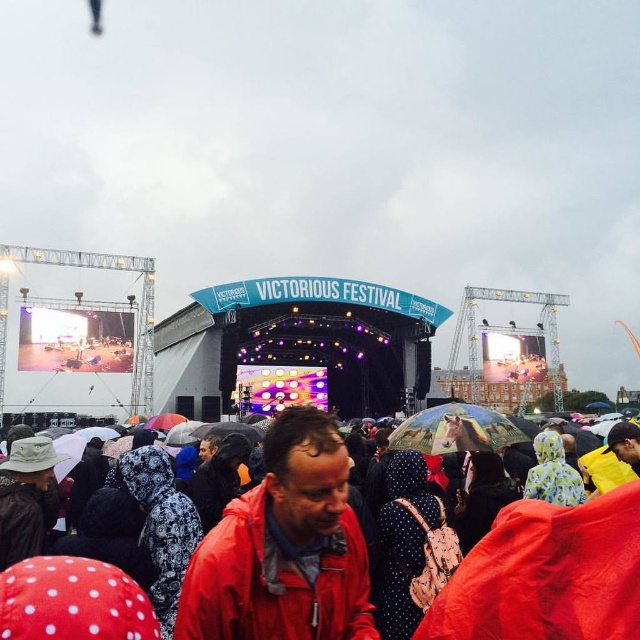
Question: Which of the following is the farthest from the observer?

Choices:
 (A) transparent plastic umbrella at center
 (B) red raincoat at lower center
 (C) red matte jacket at center

Answer: (A)

Question: Does red matte jacket at center have a smaller size compared to transparent plastic umbrella at center?

Choices:
 (A) yes
 (B) no

Answer: (B)

Question: Estimate the real-world distances between objects in this image. Which object is closer to the red matte jacket at center?

Choices:
 (A) red raincoat at lower center
 (B) transparent plastic umbrella at center

Answer: (A)

Question: Can you confirm if red raincoat at lower center is smaller than transparent plastic umbrella at center?

Choices:
 (A) no
 (B) yes

Answer: (A)

Question: Considering the real-world distances, which object is farthest from the red matte jacket at center?

Choices:
 (A) transparent plastic umbrella at center
 (B) red raincoat at lower center

Answer: (A)

Question: Is red raincoat at lower center smaller than red matte jacket at center?

Choices:
 (A) yes
 (B) no

Answer: (B)